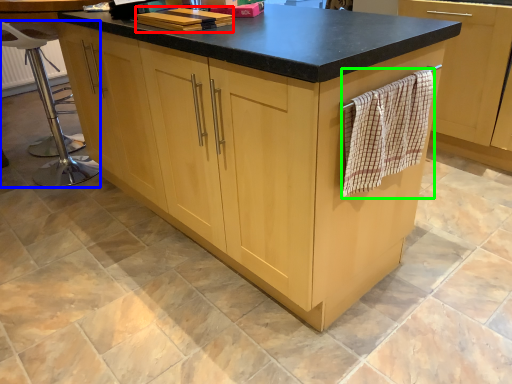
Question: Which object is positioned farthest from book (highlighted by a red box)? Select from bar stool (highlighted by a blue box) and bath towel (highlighted by a green box).

Choices:
 (A) bar stool
 (B) bath towel

Answer: (A)